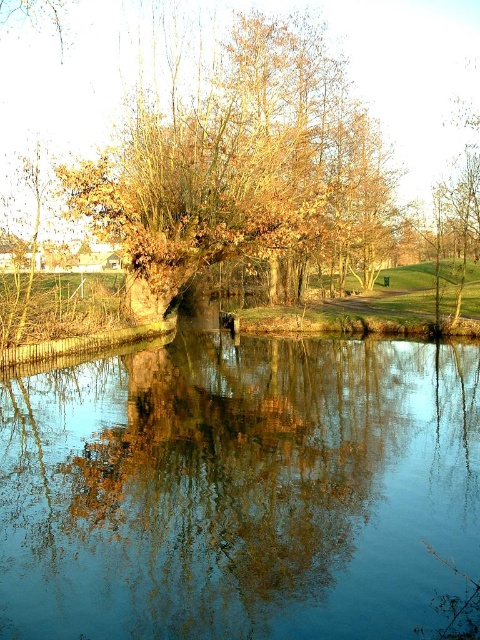
You are standing at the edge of the water body and see two points in the scene. The first point is at coordinates point (81, 390) and the second is at point (288, 192). Which point is nearer to you?

Point (81, 390) is closer to the viewer than point (288, 192).

You are standing at the edge of the water and want to take a photo of both the blue reflective water at center and the brown leafy tree at center. Which object should you position closer to the left side of your camera frame?

You should position the blue reflective water at center closer to the left side of your camera frame because it is already on the left side of the brown leafy tree at center according to the description.

You are standing at the edge of the water body and notice a point marked by coordinates. Which object in the scene corresponds to the coordinates point (239,490)?

The coordinates point (239,490) corresponds to the blue reflective water at center.